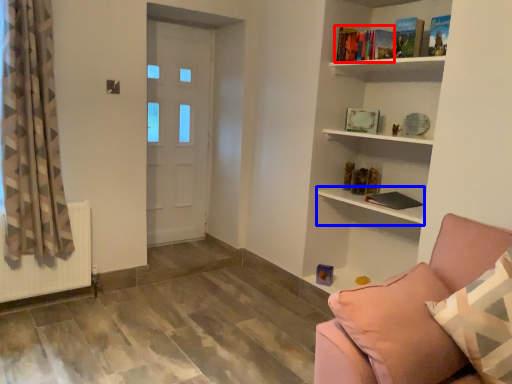
Question: Which object appears farthest to the camera in this image, book (highlighted by a red box) or shelf (highlighted by a blue box)?

Choices:
 (A) book
 (B) shelf

Answer: (A)